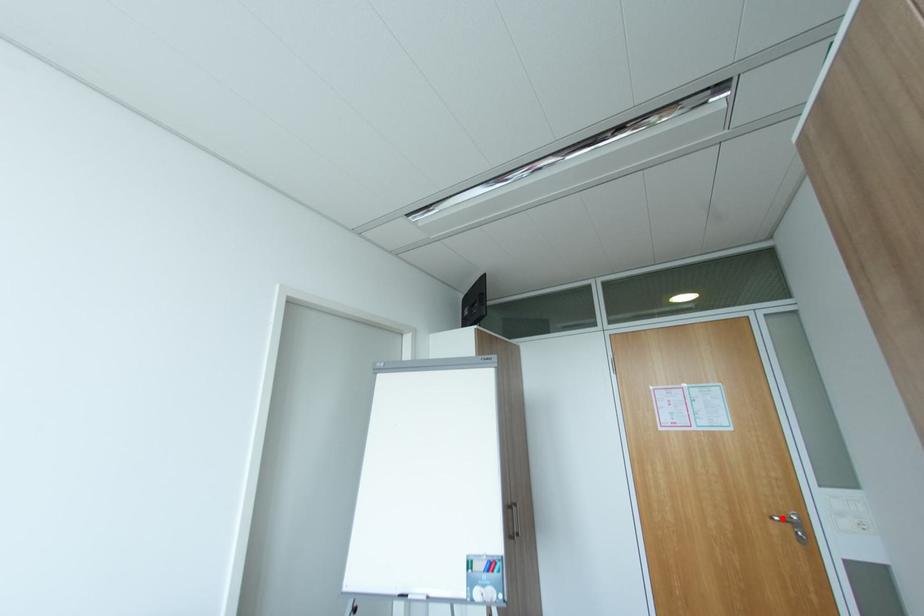
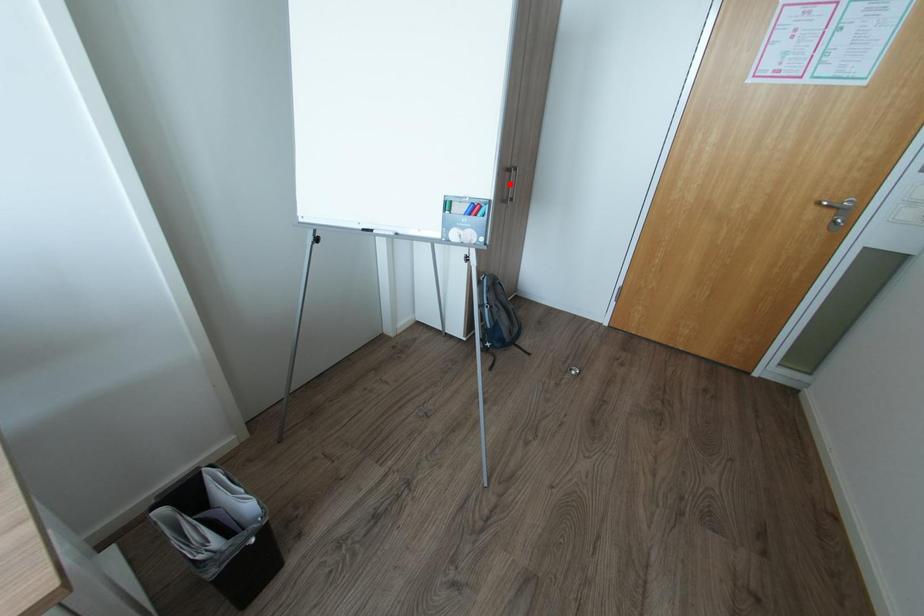
I am providing you with two images of the same scene from different viewpoints. A red point is marked on the first image and another point is marked on the second image. Does the point marked in image1 correspond to the same location as the one in image2?

No